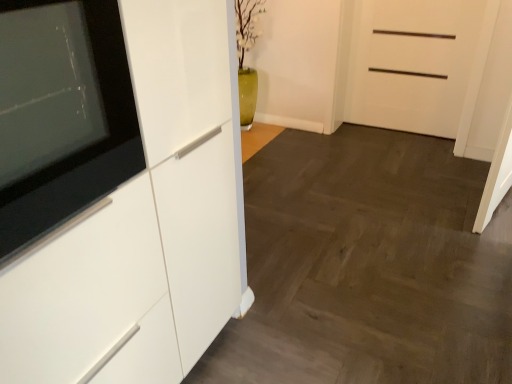
Question: Is white glossy cabinet at left further to the viewer compared to white matte door at upper right?

Choices:
 (A) no
 (B) yes

Answer: (A)

Question: Is white glossy cabinet at left touching white matte door at upper right?

Choices:
 (A) yes
 (B) no

Answer: (B)

Question: Is white matte door at upper right inside white glossy cabinet at left?

Choices:
 (A) no
 (B) yes

Answer: (A)

Question: Is white glossy cabinet at left not within white matte door at upper right?

Choices:
 (A) yes
 (B) no

Answer: (A)

Question: From the image's perspective, is white glossy cabinet at left located beneath white matte door at upper right?

Choices:
 (A) no
 (B) yes

Answer: (B)

Question: Does white glossy cabinet at left appear on the right side of white matte door at upper right?

Choices:
 (A) no
 (B) yes

Answer: (A)

Question: Is the position of black glossy tv at left less distant than that of white matte door at upper right?

Choices:
 (A) yes
 (B) no

Answer: (A)

Question: Are black glossy tv at left and white matte door at upper right far apart?

Choices:
 (A) yes
 (B) no

Answer: (A)

Question: Can you confirm if black glossy tv at left is thinner than white matte door at upper right?

Choices:
 (A) yes
 (B) no

Answer: (A)

Question: Is black glossy tv at left turned away from white matte door at upper right?

Choices:
 (A) yes
 (B) no

Answer: (B)

Question: Is black glossy tv at left placed right next to white matte door at upper right?

Choices:
 (A) yes
 (B) no

Answer: (B)

Question: From a real-world perspective, is black glossy tv at left physically below white matte door at upper right?

Choices:
 (A) no
 (B) yes

Answer: (A)

Question: Is black glossy tv at left at the left side of white glossy cabinet at left?

Choices:
 (A) yes
 (B) no

Answer: (A)